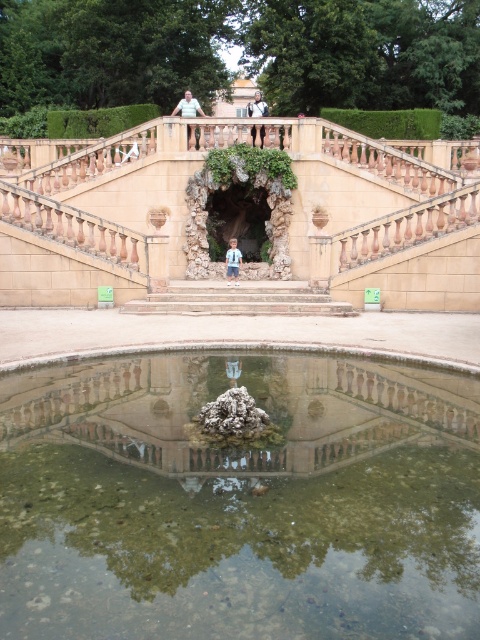
Question: Where is light blue denim shorts at center located in relation to light blue denim shorts at upper center in the image?

Choices:
 (A) below
 (B) above

Answer: (A)

Question: Does beige stone balustrade at upper center have a smaller size compared to matte blue shirt at upper center?

Choices:
 (A) yes
 (B) no

Answer: (B)

Question: Estimate the real-world distances between objects in this image. Which object is closer to the light blue denim shorts at upper center?

Choices:
 (A) clear glass water at center
 (B) blue denim shorts at center
 (C) light blue denim shorts at center
 (D) stone steps at center

Answer: (C)

Question: Which of the following is the closest to the observer?

Choices:
 (A) light blue denim shorts at center
 (B) stone steps at center
 (C) beige stone balustrade at upper center
 (D) light blue denim shorts at upper center

Answer: (B)

Question: Which of the following is the farthest from the observer?

Choices:
 (A) (261, 490)
 (B) (320, 296)

Answer: (B)

Question: Does stone steps at center have a larger size compared to light blue denim shorts at center?

Choices:
 (A) yes
 (B) no

Answer: (A)